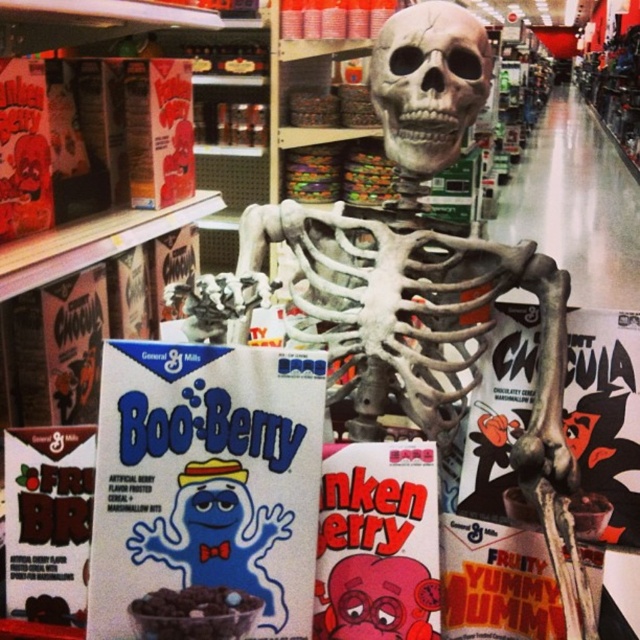
Measure the distance between point [378,445] and camera.

Point [378,445] is 37.09 inches from camera.

Is rubberized plastic comic book at center taller than smooth chocolate cereal at center?

Indeed, rubberized plastic comic book at center has a greater height compared to smooth chocolate cereal at center.

What do you see at coordinates (378, 541) in the screenshot? I see `rubberized plastic comic book at center` at bounding box center [378, 541].

Locate an element on the screen. The image size is (640, 640). rubberized plastic comic book at center is located at coordinates click(x=378, y=541).

Which is in front, point (433, 570) or point (184, 612)?

Positioned in front is point (184, 612).

Is rubberized plastic comic book at center to the right of matte blue ghost cereal box at center from the viewer's perspective?

Indeed, rubberized plastic comic book at center is positioned on the right side of matte blue ghost cereal box at center.

At what (x,y) coordinates should I click in order to perform the action: click on rubberized plastic comic book at center. Please return your answer as a coordinate pair (x, y). This screenshot has height=640, width=640. Looking at the image, I should click on (378, 541).

Between gray matte skull at center and fruity yummy mummy cereal at center, which one appears on the left side from the viewer's perspective?

From the viewer's perspective, gray matte skull at center appears more on the left side.

Who is shorter, gray matte skull at center or fruity yummy mummy cereal at center?

fruity yummy mummy cereal at center is shorter.

Is point (406, 140) positioned in front of point (448, 563)?

Yes.

Where is `gray matte skull at center`? gray matte skull at center is located at coordinates (428, 83).